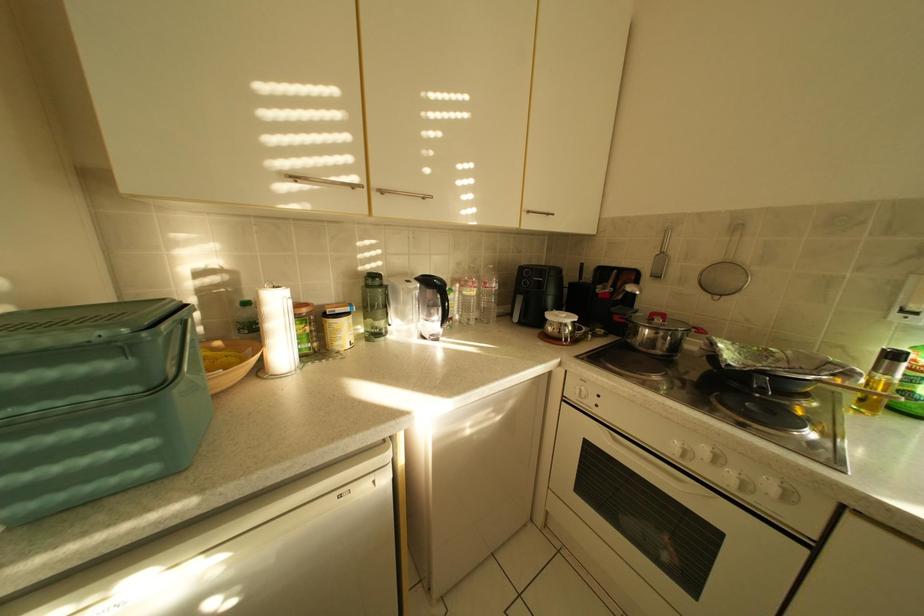
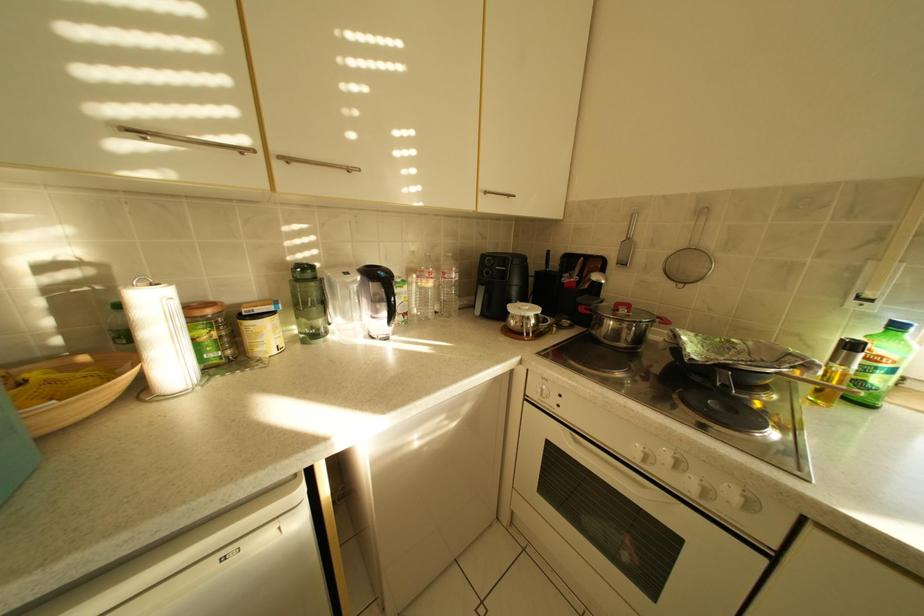
Question: How did the camera likely rotate?

Choices:
 (A) Left
 (B) Right
 (C) Up
 (D) Down

Answer: (B)